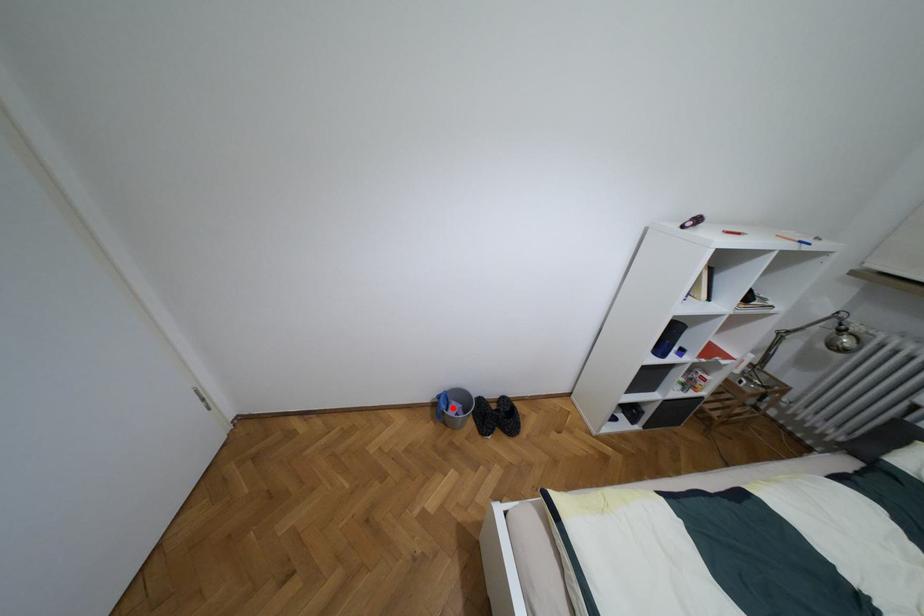
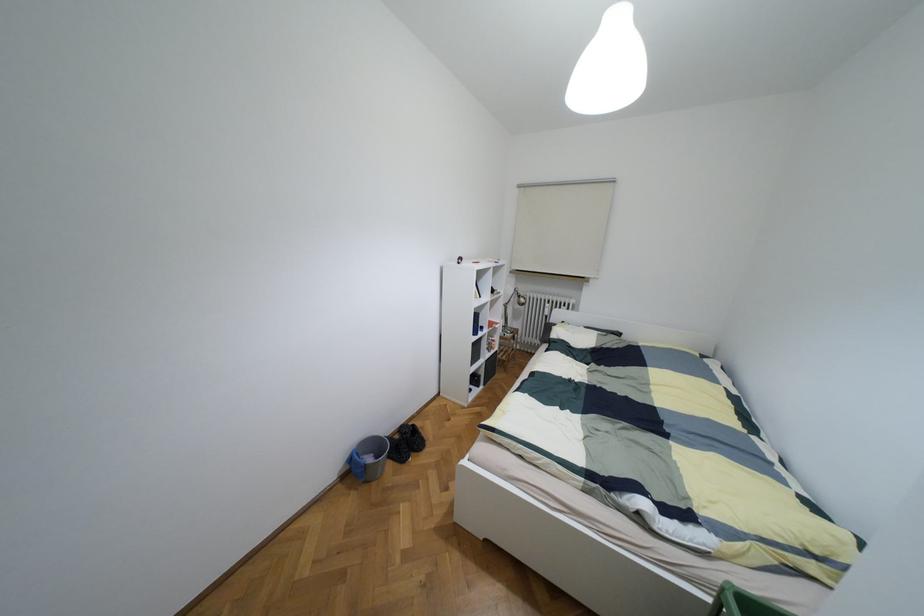
Question: I am providing you with two images of the same scene from different viewpoints. A red point is shown in image1. For the corresponding object point in image2, is it positioned nearer or farther from the camera?

Choices:
 (A) Nearer
 (B) Farther

Answer: (A)